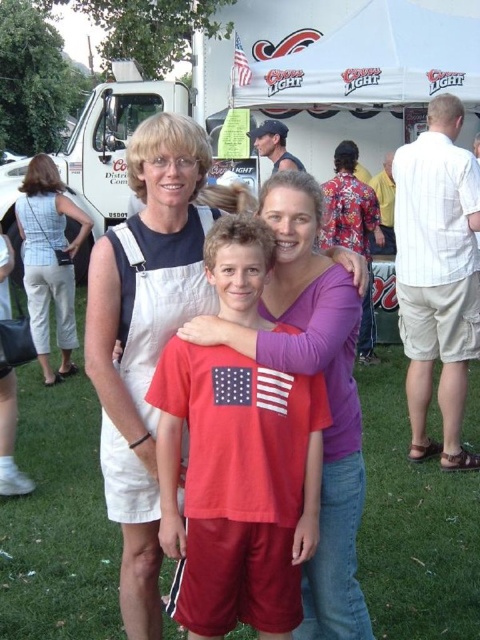
What is the location of the point with coordinates (144, 337) in the image?

The point with coordinates (144, 337) is located on the white cotton overalls at center.